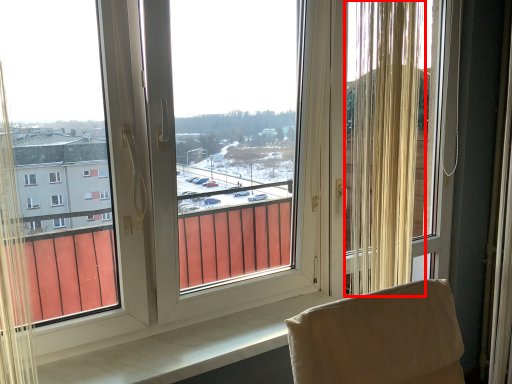
Question: From the image's perspective, considering the relative positions of curtain (annotated by the red box) and window screen in the image provided, where is curtain (annotated by the red box) located with respect to the staircase?

Choices:
 (A) above
 (B) below

Answer: (A)